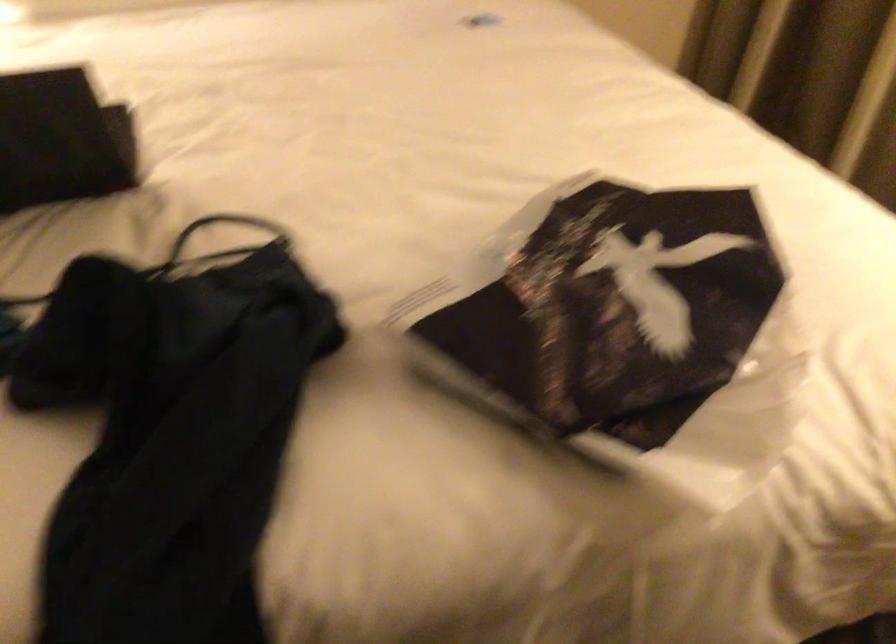
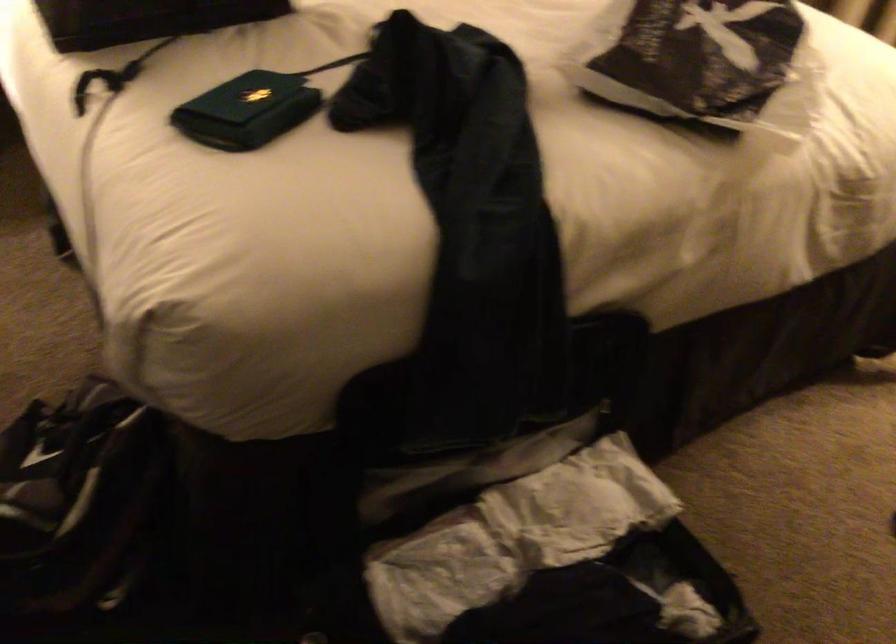
Question: The first image is from the beginning of the video and the second image is from the end. How did the camera likely rotate when shooting the video?

Choices:
 (A) Left
 (B) Right
 (C) Up
 (D) Down

Answer: (B)